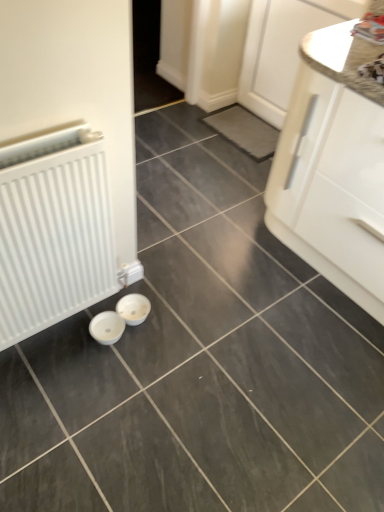
Describe the element at coordinates (282, 49) in the screenshot. I see `white glossy cabinet at upper right, the 2th cabinetry when ordered from bottom to top` at that location.

Describe the element at coordinates (53, 229) in the screenshot. This screenshot has width=384, height=512. I see `white matte radiator at left` at that location.

This screenshot has width=384, height=512. In order to click on white glossy cabinet at upper right, the 2th cabinetry when ordered from bottom to top in this screenshot , I will do `click(282, 49)`.

Which of these two, white glossy cabinet at upper right, the 2th cabinetry when ordered from bottom to top, or white matte radiator at left, stands taller?

With more height is white glossy cabinet at upper right, the 2th cabinetry when ordered from bottom to top.

Is white glossy cabinet at upper right, which appears as the first cabinetry when viewed from the top, not inside white matte radiator at left?

Yes, white glossy cabinet at upper right, which appears as the first cabinetry when viewed from the top, is not within white matte radiator at left.

Could you tell me if white glossy cabinet at upper right, which appears as the first cabinetry when viewed from the top, is facing white matte radiator at left?

Yes, white glossy cabinet at upper right, which appears as the first cabinetry when viewed from the top, is facing white matte radiator at left.

The image size is (384, 512). Find the location of `radiator lying in front of the white glossy cabinet at upper right, the 2th cabinetry when ordered from bottom to top`. radiator lying in front of the white glossy cabinet at upper right, the 2th cabinetry when ordered from bottom to top is located at coordinates (53, 229).

What's the angular difference between white glossy cabinet at right, marked as the second cabinetry in a top-to-bottom arrangement, and white glossy cabinet at upper right, which appears as the first cabinetry when viewed from the top,'s facing directions?

They differ by 0.228 degrees in their facing directions.

Considering the sizes of objects white glossy cabinet at right, the 1th cabinetry when ordered from bottom to top, and white glossy cabinet at upper right, the 2th cabinetry when ordered from bottom to top, in the image provided, who is thinner, white glossy cabinet at right, the 1th cabinetry when ordered from bottom to top, or white glossy cabinet at upper right, the 2th cabinetry when ordered from bottom to top,?

Thinner between the two is white glossy cabinet at upper right, the 2th cabinetry when ordered from bottom to top.

Where is `cabinetry on the right of the white glossy cabinet at upper right, which appears as the first cabinetry when viewed from the top`? The image size is (384, 512). cabinetry on the right of the white glossy cabinet at upper right, which appears as the first cabinetry when viewed from the top is located at coordinates (331, 173).

Is white matte radiator at left beside white glossy cabinet at upper right, the 2th cabinetry when ordered from bottom to top?

No.

Which is nearer, (x=65, y=298) or (x=251, y=75)?

Point (x=65, y=298).

How many degrees apart are the facing directions of white matte radiator at left and white glossy cabinet at upper right, the 2th cabinetry when ordered from bottom to top?

The facing directions of white matte radiator at left and white glossy cabinet at upper right, the 2th cabinetry when ordered from bottom to top, are 88.5 degrees apart.

Considering the relative positions of white glossy cabinet at right, the 1th cabinetry when ordered from bottom to top, and white matte radiator at left in the image provided, is white glossy cabinet at right, the 1th cabinetry when ordered from bottom to top, to the left of white matte radiator at left from the viewer's perspective?

No, white glossy cabinet at right, the 1th cabinetry when ordered from bottom to top, is not to the left of white matte radiator at left.

Is white glossy cabinet at right, marked as the second cabinetry in a top-to-bottom arrangement, looking in the opposite direction of white matte radiator at left?

No, white glossy cabinet at right, marked as the second cabinetry in a top-to-bottom arrangement, is not facing away from white matte radiator at left.

Locate an element on the screen. This screenshot has width=384, height=512. cabinetry that is the 1st one when counting upward from the white matte radiator at left (from the image's perspective) is located at coordinates (331, 173).

Does point (295, 67) lie in front of point (368, 217)?

No.

How much distance is there between white glossy cabinet at upper right, which appears as the first cabinetry when viewed from the top, and white glossy cabinet at right, marked as the second cabinetry in a top-to-bottom arrangement?

white glossy cabinet at upper right, which appears as the first cabinetry when viewed from the top, and white glossy cabinet at right, marked as the second cabinetry in a top-to-bottom arrangement, are 39.36 inches apart.

From the image's perspective, is white glossy cabinet at upper right, the 2th cabinetry when ordered from bottom to top, above or below white glossy cabinet at right, the 1th cabinetry when ordered from bottom to top?

Based on their image positions, white glossy cabinet at upper right, the 2th cabinetry when ordered from bottom to top, is located above white glossy cabinet at right, the 1th cabinetry when ordered from bottom to top.

In the scene shown: Considering the positions of objects white glossy cabinet at upper right, the 2th cabinetry when ordered from bottom to top, and white glossy cabinet at right, marked as the second cabinetry in a top-to-bottom arrangement, in the image provided, who is more to the left, white glossy cabinet at upper right, the 2th cabinetry when ordered from bottom to top, or white glossy cabinet at right, marked as the second cabinetry in a top-to-bottom arrangement,?

Positioned to the left is white glossy cabinet at upper right, the 2th cabinetry when ordered from bottom to top.

Is white matte radiator at left taller or shorter than white glossy cabinet at right, the 1th cabinetry when ordered from bottom to top?

Considering their sizes, white matte radiator at left has less height than white glossy cabinet at right, the 1th cabinetry when ordered from bottom to top.

Which object is further away from the camera taking this photo, white matte radiator at left or white glossy cabinet at right, marked as the second cabinetry in a top-to-bottom arrangement?

white glossy cabinet at right, marked as the second cabinetry in a top-to-bottom arrangement.

Which is more to the right, white matte radiator at left or white glossy cabinet at right, marked as the second cabinetry in a top-to-bottom arrangement?

white glossy cabinet at right, marked as the second cabinetry in a top-to-bottom arrangement.

Identify the location of radiator that appears on the left of white glossy cabinet at upper right, which appears as the first cabinetry when viewed from the top. This screenshot has height=512, width=384. (53, 229).

The image size is (384, 512). Identify the location of cabinetry located above the white glossy cabinet at upper right, which appears as the first cabinetry when viewed from the top (from a real-world perspective). (331, 173).

From the image, which object appears to be nearer to white matte radiator at left, white glossy cabinet at right, the 1th cabinetry when ordered from bottom to top, or white glossy cabinet at upper right, the 2th cabinetry when ordered from bottom to top?

white glossy cabinet at right, the 1th cabinetry when ordered from bottom to top, is positioned closer to the anchor white matte radiator at left.

Based on their spatial positions, is white glossy cabinet at right, marked as the second cabinetry in a top-to-bottom arrangement, or white matte radiator at left closer to white glossy cabinet at upper right, the 2th cabinetry when ordered from bottom to top?

Among the two, white glossy cabinet at right, marked as the second cabinetry in a top-to-bottom arrangement, is located nearer to white glossy cabinet at upper right, the 2th cabinetry when ordered from bottom to top.

Based on their spatial positions, is white glossy cabinet at upper right, the 2th cabinetry when ordered from bottom to top, or white matte radiator at left closer to white glossy cabinet at right, marked as the second cabinetry in a top-to-bottom arrangement?

white glossy cabinet at upper right, the 2th cabinetry when ordered from bottom to top.

When comparing their distances from white glossy cabinet at right, marked as the second cabinetry in a top-to-bottom arrangement, does white matte radiator at left or white glossy cabinet at upper right, which appears as the first cabinetry when viewed from the top, seem closer?

white glossy cabinet at upper right, which appears as the first cabinetry when viewed from the top, is closer to white glossy cabinet at right, marked as the second cabinetry in a top-to-bottom arrangement.

From the picture: When comparing their distances from white glossy cabinet at upper right, which appears as the first cabinetry when viewed from the top, does white matte radiator at left or white glossy cabinet at right, marked as the second cabinetry in a top-to-bottom arrangement, seem closer?

Among the two, white glossy cabinet at right, marked as the second cabinetry in a top-to-bottom arrangement, is located nearer to white glossy cabinet at upper right, which appears as the first cabinetry when viewed from the top.

Looking at this image, which object lies further to the anchor point white matte radiator at left, white glossy cabinet at upper right, the 2th cabinetry when ordered from bottom to top, or white glossy cabinet at right, marked as the second cabinetry in a top-to-bottom arrangement?

The object further to white matte radiator at left is white glossy cabinet at upper right, the 2th cabinetry when ordered from bottom to top.

The height and width of the screenshot is (512, 384). Find the location of `cabinetry between white matte radiator at left and white glossy cabinet at right, marked as the second cabinetry in a top-to-bottom arrangement, from left to right`. cabinetry between white matte radiator at left and white glossy cabinet at right, marked as the second cabinetry in a top-to-bottom arrangement, from left to right is located at coordinates (282, 49).